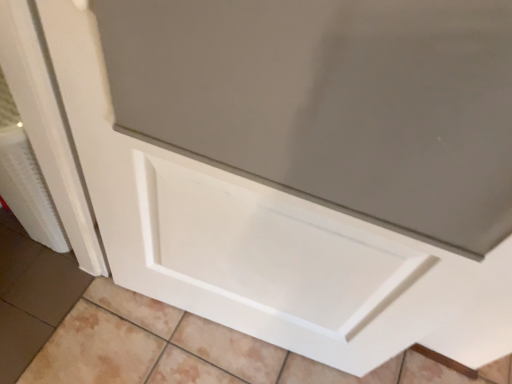
Locate an element on the screen. white glossy tile at lower center is located at coordinates (196, 350).

The width and height of the screenshot is (512, 384). What do you see at coordinates (196, 350) in the screenshot? I see `white glossy tile at lower center` at bounding box center [196, 350].

I want to click on white glossy tile at lower center, so click(x=196, y=350).